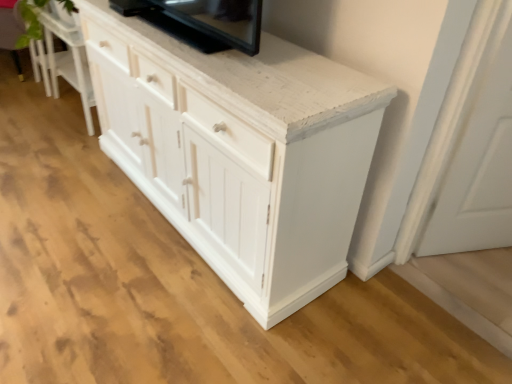
Where is `vacant space underneath green leafy plant at upper left (from a real-world perspective)`? This screenshot has height=384, width=512. vacant space underneath green leafy plant at upper left (from a real-world perspective) is located at coordinates (72, 136).